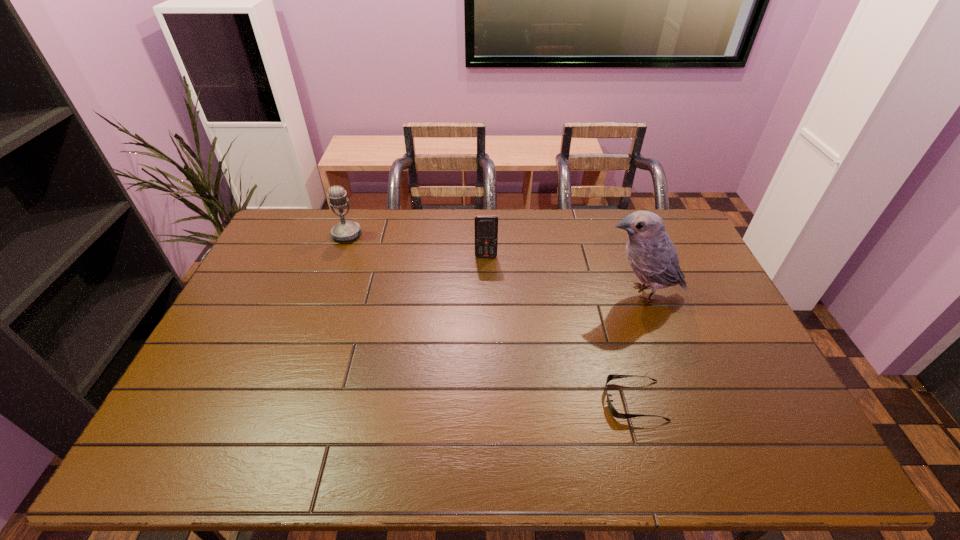
In order to click on vacant region located on the front-facing side of the third farthest object in this screenshot , I will do `click(523, 294)`.

Where is `free space located 0.320m on the front-facing side of the leftmost object`? free space located 0.320m on the front-facing side of the leftmost object is located at coordinates (321, 308).

Locate an element on the screen. The image size is (960, 540). vacant space located 0.230m on the screen of the second shortest object is located at coordinates (487, 306).

Find the location of `free spot located 0.250m on the front-facing side of the shortest object`. free spot located 0.250m on the front-facing side of the shortest object is located at coordinates (508, 401).

The width and height of the screenshot is (960, 540). I want to click on free space located on the front-facing side of the shortest object, so click(453, 401).

Where is `free space located 0.180m on the front-facing side of the shortest object`? Image resolution: width=960 pixels, height=540 pixels. free space located 0.180m on the front-facing side of the shortest object is located at coordinates (535, 401).

At what (x,y) coordinates should I click in order to perform the action: click on object that is at the far edge. Please return your answer as a coordinate pair (x, y). Looking at the image, I should click on (345, 230).

At what (x,y) coordinates should I click in order to perform the action: click on object at the right edge. Please return your answer as a coordinate pair (x, y). The height and width of the screenshot is (540, 960). Looking at the image, I should click on (653, 257).

Where is `vacant space at the far edge of the desktop`? vacant space at the far edge of the desktop is located at coordinates (408, 217).

I want to click on free space at the near edge, so click(719, 449).